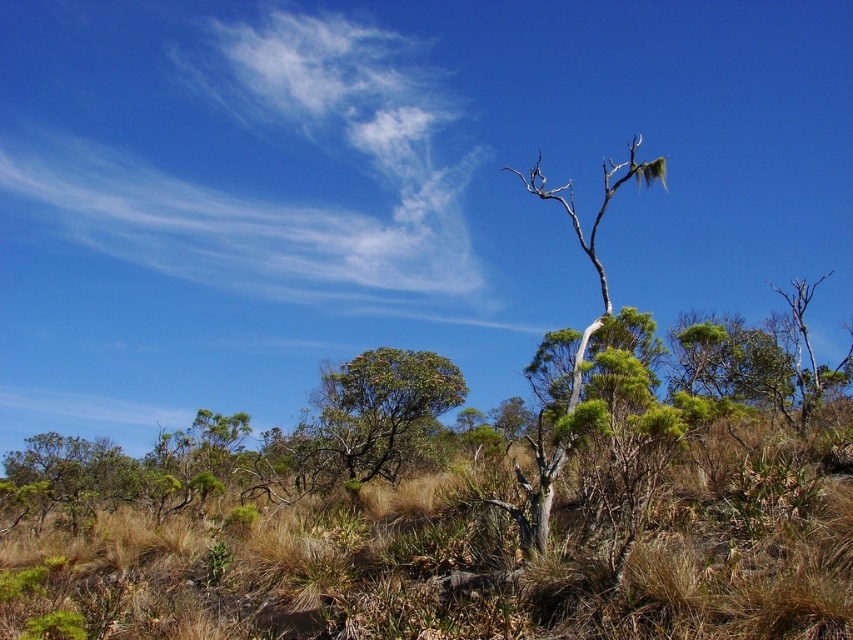
Measure the distance from green leafy shrub at center to gray bark tree at center.

They are 41.43 feet apart.

Can you confirm if green leafy shrub at center is taller than gray bark tree at center?

No, green leafy shrub at center is not taller than gray bark tree at center.

Is point (409, 371) farther from viewer compared to point (643, 163)?

Yes, point (409, 371) is behind point (643, 163).

You are a GUI agent. You are given a task and a screenshot of the screen. Output one action in this format:
    pyautogui.click(x=<x>, y=<y>)
    Task: Click on the green leafy shrub at center
    This screenshot has width=853, height=640.
    Given the screenshot: What is the action you would take?
    pyautogui.click(x=381, y=408)